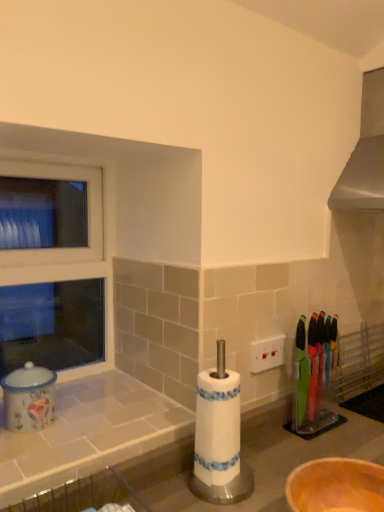
Question: Is white tile counter at lower left a part of matte ceramic coffee canister at left?

Choices:
 (A) no
 (B) yes

Answer: (A)

Question: From a real-world perspective, is matte ceramic coffee canister at left physically above white tile counter at lower left?

Choices:
 (A) no
 (B) yes

Answer: (B)

Question: Can you confirm if matte ceramic coffee canister at left is thinner than white tile counter at lower left?

Choices:
 (A) no
 (B) yes

Answer: (B)

Question: Is matte ceramic coffee canister at left facing towards white tile counter at lower left?

Choices:
 (A) no
 (B) yes

Answer: (A)

Question: From the image's perspective, does matte ceramic coffee canister at left appear higher than white tile counter at lower left?

Choices:
 (A) no
 (B) yes

Answer: (B)

Question: Is point (145, 423) positioned closer to the camera than point (44, 425)?

Choices:
 (A) closer
 (B) farther

Answer: (B)

Question: Would you say white tile counter at lower left is inside or outside matte ceramic coffee canister at left?

Choices:
 (A) outside
 (B) inside

Answer: (A)

Question: Would you say white tile counter at lower left is to the left or to the right of matte ceramic coffee canister at left in the picture?

Choices:
 (A) left
 (B) right

Answer: (B)

Question: Is white tile counter at lower left in front of or behind matte ceramic coffee canister at left in the image?

Choices:
 (A) behind
 (B) front

Answer: (B)

Question: Is matte ceramic coffee canister at left wider or thinner than translucent plastic knives at right?

Choices:
 (A) thin
 (B) wide

Answer: (B)

Question: In terms of height, does matte ceramic coffee canister at left look taller or shorter compared to translucent plastic knives at right?

Choices:
 (A) short
 (B) tall

Answer: (A)

Question: Does point (11, 378) appear closer or farther from the camera than point (334, 422)?

Choices:
 (A) farther
 (B) closer

Answer: (B)

Question: Is matte ceramic coffee canister at left situated inside translucent plastic knives at right or outside?

Choices:
 (A) inside
 (B) outside

Answer: (B)

Question: Considering the positions of translucent plastic knives at right and matte ceramic coffee canister at left in the image, is translucent plastic knives at right wider or thinner than matte ceramic coffee canister at left?

Choices:
 (A) wide
 (B) thin

Answer: (B)

Question: Considering their positions, is translucent plastic knives at right located in front of or behind matte ceramic coffee canister at left?

Choices:
 (A) behind
 (B) front

Answer: (A)